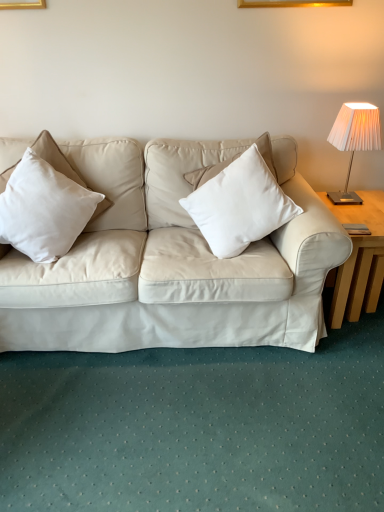
What is the approximate width of white cotton pillow at left, marked as the 1th pillow in a left-to-right arrangement?

white cotton pillow at left, marked as the 1th pillow in a left-to-right arrangement, is 19.78 inches in width.

What are the coordinates of `light wood table at right` in the screenshot? It's located at (359, 259).

What do you see at coordinates (354, 140) in the screenshot? This screenshot has width=384, height=512. I see `white pleated fabric lampshade at upper right` at bounding box center [354, 140].

Image resolution: width=384 pixels, height=512 pixels. What do you see at coordinates (239, 205) in the screenshot?
I see `white matte pillow at center, acting as the second pillow starting from the left` at bounding box center [239, 205].

This screenshot has width=384, height=512. In order to click on white cotton pillow at left, marked as the 1th pillow in a left-to-right arrangement in this screenshot , I will do `click(44, 206)`.

From a real-world perspective, which is physically below, white cotton pillow at left, marked as the 1th pillow in a left-to-right arrangement, or light wood table at right?

In real-world perspective, light wood table at right is lower.

Considering the sizes of objects white cotton pillow at left, marked as the 1th pillow in a left-to-right arrangement, and light wood table at right in the image provided, who is shorter, white cotton pillow at left, marked as the 1th pillow in a left-to-right arrangement, or light wood table at right?

With less height is white cotton pillow at left, marked as the 1th pillow in a left-to-right arrangement.

From the light wood table at right, count 2nd pillows forward and point to it. Please provide its 2D coordinates.

[(44, 206)]

Which object is more forward, white cotton pillow at left, marked as the 2th pillow in a right-to-left arrangement, or light wood table at right?

Positioned in front is white cotton pillow at left, marked as the 2th pillow in a right-to-left arrangement.

From a real-world perspective, which object rests below the other?

From a 3D spatial view, light wood table at right is below.

Which of these two, light wood table at right or white cotton pillow at left, marked as the 2th pillow in a right-to-left arrangement, is bigger?

Bigger between the two is light wood table at right.

Looking at this image, what's the angular difference between light wood table at right and white cotton pillow at left, marked as the 1th pillow in a left-to-right arrangement,'s facing directions?

They differ by 24.4 degrees in their facing directions.

Can you confirm if light wood table at right is shorter than white cotton pillow at left, marked as the 1th pillow in a left-to-right arrangement?

Incorrect, the height of light wood table at right does not fall short of that of white cotton pillow at left, marked as the 1th pillow in a left-to-right arrangement.

Is white pleated fabric lampshade at upper right completely or partially outside of white cotton pillow at left, marked as the 1th pillow in a left-to-right arrangement?

white pleated fabric lampshade at upper right is positioned outside white cotton pillow at left, marked as the 1th pillow in a left-to-right arrangement.

From the image's perspective, which one is positioned lower, white pleated fabric lampshade at upper right or white cotton pillow at left, marked as the 1th pillow in a left-to-right arrangement?

From the image's view, white cotton pillow at left, marked as the 1th pillow in a left-to-right arrangement, is below.

Is white pleated fabric lampshade at upper right to the left or to the right of white cotton pillow at left, marked as the 2th pillow in a right-to-left arrangement, in the image?

From the image, it's evident that white pleated fabric lampshade at upper right is to the right of white cotton pillow at left, marked as the 2th pillow in a right-to-left arrangement.

From the image's perspective, relative to white pleated fabric lampshade at upper right, is light wood table at right above or below?

Based on their image positions, light wood table at right is located beneath white pleated fabric lampshade at upper right.

Considering the positions of point (369, 285) and point (342, 146), is point (369, 285) closer or farther from the camera than point (342, 146)?

Point (369, 285) is positioned farther from the camera compared to point (342, 146).

Is white pleated fabric lampshade at upper right at the back of light wood table at right?

No, light wood table at right is not facing the opposite direction of white pleated fabric lampshade at upper right.

Considering the positions of point (271, 228) and point (356, 129), is point (271, 228) closer or farther from the camera than point (356, 129)?

Point (271, 228).

From the image's perspective, is white matte pillow at center, which is the first pillow from right to left, located above or below white pleated fabric lampshade at upper right?

From the image's perspective, white matte pillow at center, which is the first pillow from right to left, appears below white pleated fabric lampshade at upper right.

From a real-world perspective, is white matte pillow at center, which is the first pillow from right to left, on white pleated fabric lampshade at upper right?

Incorrect, from a real-world perspective, white matte pillow at center, which is the first pillow from right to left, is lower than white pleated fabric lampshade at upper right.

Between white matte pillow at center, acting as the second pillow starting from the left, and white pleated fabric lampshade at upper right, which one has more height?

white matte pillow at center, acting as the second pillow starting from the left, is taller.

Can you tell me how much white matte pillow at center, which is the first pillow from right to left, and light wood table at right differ in facing direction?

14.4 degrees separate the facing orientations of white matte pillow at center, which is the first pillow from right to left, and light wood table at right.

Consider the image. Measure the distance between white matte pillow at center, which is the first pillow from right to left, and light wood table at right.

19.77 inches.

Does white matte pillow at center, which is the first pillow from right to left, touch light wood table at right?

No, white matte pillow at center, which is the first pillow from right to left, is not next to light wood table at right.

From the image's perspective, which is below, white matte pillow at center, which is the first pillow from right to left, or light wood table at right?

From the image's view, light wood table at right is below.

The height and width of the screenshot is (512, 384). I want to click on table below the white pleated fabric lampshade at upper right (from a real-world perspective), so click(x=359, y=259).

Considering the relative positions of white pleated fabric lampshade at upper right and light wood table at right in the image provided, is white pleated fabric lampshade at upper right behind light wood table at right?

Yes, white pleated fabric lampshade at upper right is further from the camera.

Which point is more distant from viewer, (375,113) or (355,209)?

The point (355,209) is farther from the camera.

Find the location of a particular element. This screenshot has height=512, width=384. table on the right of white cotton pillow at left, marked as the 2th pillow in a right-to-left arrangement is located at coordinates (359, 259).

The height and width of the screenshot is (512, 384). In order to click on table below the white cotton pillow at left, marked as the 1th pillow in a left-to-right arrangement (from a real-world perspective) in this screenshot , I will do `click(359, 259)`.

In the scene shown: Considering their positions, is white matte pillow at center, acting as the second pillow starting from the left, positioned closer to white pleated fabric lampshade at upper right than white cotton pillow at left, marked as the 1th pillow in a left-to-right arrangement?

white matte pillow at center, acting as the second pillow starting from the left.

Looking at the image, which one is located closer to white cotton pillow at left, marked as the 2th pillow in a right-to-left arrangement, light wood table at right or white pleated fabric lampshade at upper right?

The object closer to white cotton pillow at left, marked as the 2th pillow in a right-to-left arrangement, is light wood table at right.

Based on the photo, looking at the image, which one is located further to white pleated fabric lampshade at upper right, white matte pillow at center, acting as the second pillow starting from the left, or light wood table at right?

Based on the image, white matte pillow at center, acting as the second pillow starting from the left, appears to be further to white pleated fabric lampshade at upper right.

From the image, which object appears to be nearer to white cotton pillow at left, marked as the 2th pillow in a right-to-left arrangement, white pleated fabric lampshade at upper right or white matte pillow at center, acting as the second pillow starting from the left?

Based on the image, white matte pillow at center, acting as the second pillow starting from the left, appears to be nearer to white cotton pillow at left, marked as the 2th pillow in a right-to-left arrangement.

When comparing their distances from light wood table at right, does white pleated fabric lampshade at upper right or white matte pillow at center, which is the first pillow from right to left, seem closer?

white pleated fabric lampshade at upper right is positioned closer to the anchor light wood table at right.

Based on the photo, when comparing their distances from white cotton pillow at left, marked as the 1th pillow in a left-to-right arrangement, does white matte pillow at center, acting as the second pillow starting from the left, or light wood table at right seem closer?

Based on the image, white matte pillow at center, acting as the second pillow starting from the left, appears to be nearer to white cotton pillow at left, marked as the 1th pillow in a left-to-right arrangement.

Considering their positions, is light wood table at right positioned further to white matte pillow at center, which is the first pillow from right to left, than white pleated fabric lampshade at upper right?

white pleated fabric lampshade at upper right is further to white matte pillow at center, which is the first pillow from right to left.

From the image, which object appears to be nearer to white cotton pillow at left, marked as the 1th pillow in a left-to-right arrangement, white matte pillow at center, which is the first pillow from right to left, or white pleated fabric lampshade at upper right?

white matte pillow at center, which is the first pillow from right to left, is closer to white cotton pillow at left, marked as the 1th pillow in a left-to-right arrangement.

This screenshot has height=512, width=384. Identify the location of pillow situated between white cotton pillow at left, marked as the 1th pillow in a left-to-right arrangement, and white pleated fabric lampshade at upper right from left to right. (239, 205).

The width and height of the screenshot is (384, 512). I want to click on pillow located between white cotton pillow at left, marked as the 1th pillow in a left-to-right arrangement, and light wood table at right in the left-right direction, so click(239, 205).

Identify the location of table lamp located between white cotton pillow at left, marked as the 2th pillow in a right-to-left arrangement, and light wood table at right in the left-right direction. The image size is (384, 512). (354, 140).

Locate an element on the screen. table lamp between white matte pillow at center, which is the first pillow from right to left, and light wood table at right from left to right is located at coordinates (354, 140).